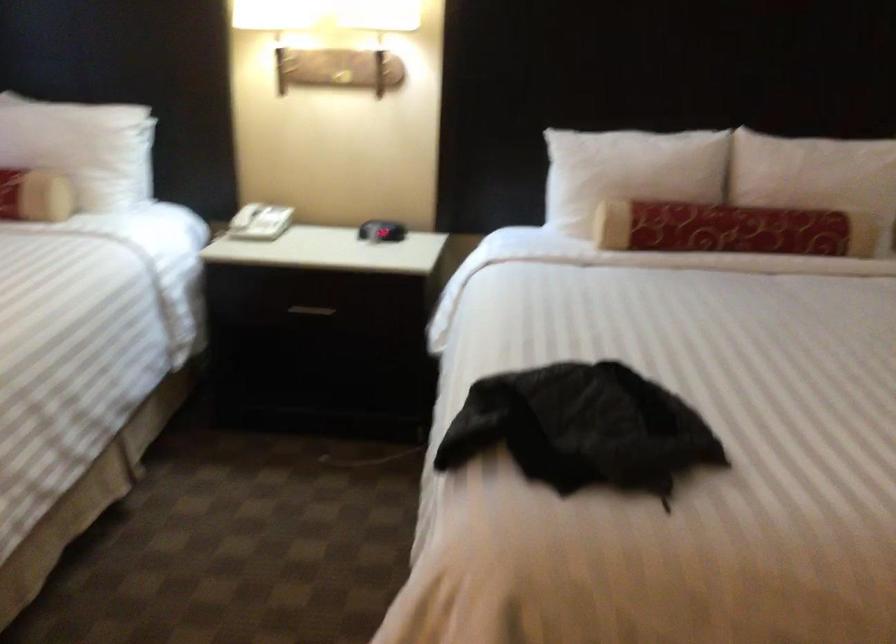
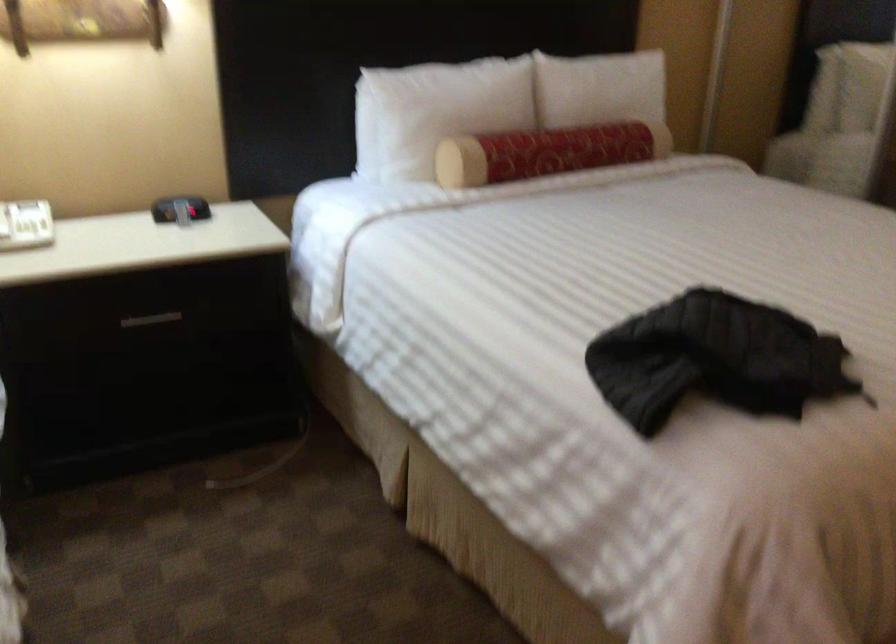
The point at (599,169) is marked in the first image. Where is the corresponding point in the second image?

(435, 111)